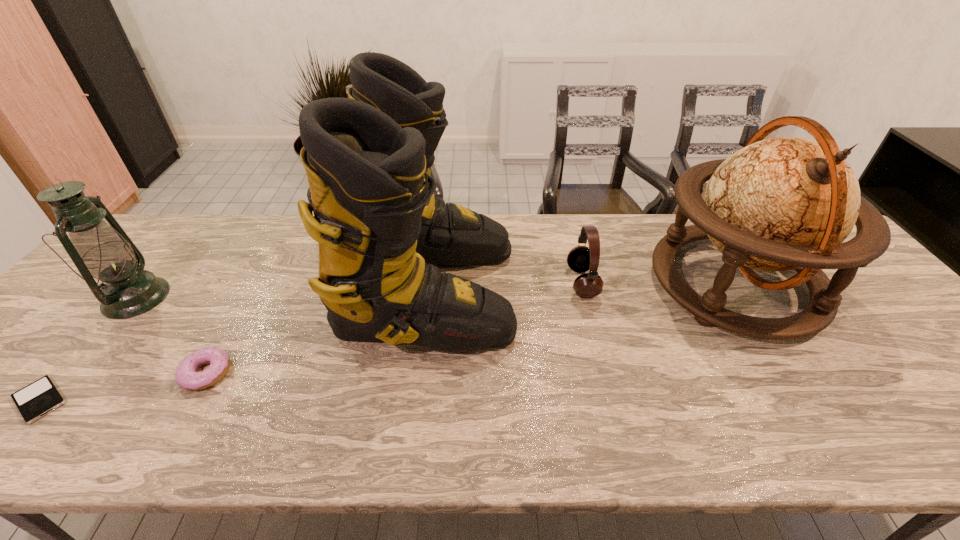
Locate an element on the screen. This screenshot has height=540, width=960. ski boots is located at coordinates (367, 157).

Locate an element on the screen. Image resolution: width=960 pixels, height=540 pixels. the rightmost object is located at coordinates (786, 203).

I want to click on globe, so click(786, 203).

Locate an element on the screen. The image size is (960, 540). oil lamp is located at coordinates (104, 251).

Locate an element on the screen. The height and width of the screenshot is (540, 960). headset is located at coordinates (580, 259).

Where is `the fourth tallest object`? Image resolution: width=960 pixels, height=540 pixels. the fourth tallest object is located at coordinates (580, 259).

Identify the location of the third object from left to right. (186, 376).

The height and width of the screenshot is (540, 960). I want to click on doughnut, so click(186, 376).

This screenshot has width=960, height=540. I want to click on vacant area situated 0.320m on the left of the ski boots, so click(x=226, y=291).

Locate an element on the screen. The height and width of the screenshot is (540, 960). vacant space positioned on the left of the globe is located at coordinates (533, 284).